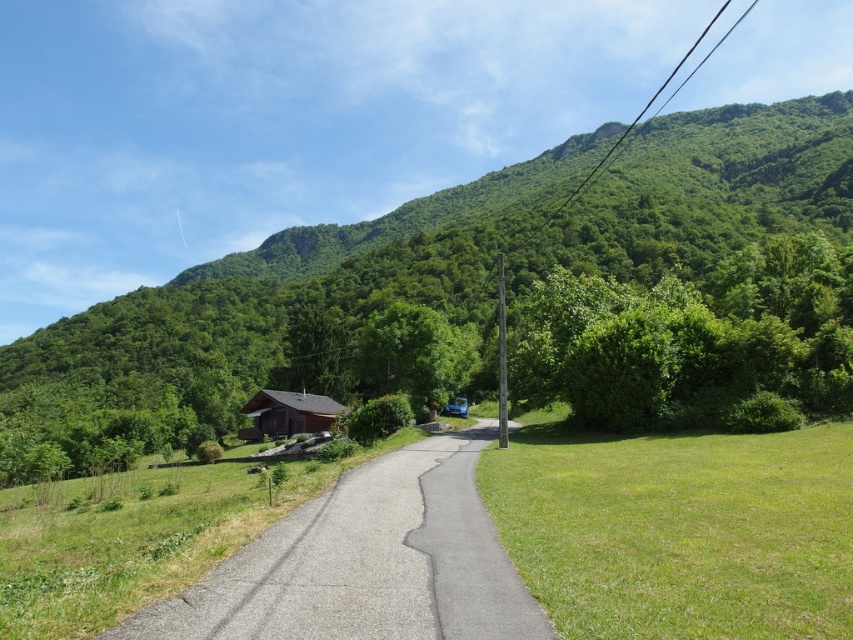
Question: Which object appears closest to the camera in this image?

Choices:
 (A) green leafy tree at center
 (B) gray asphalt driveway at center
 (C) brown wooden cabin at center

Answer: (B)

Question: Considering the relative positions of gray asphalt driveway at center and brown wooden cabin at center in the image provided, where is gray asphalt driveway at center located with respect to brown wooden cabin at center?

Choices:
 (A) above
 (B) below

Answer: (A)

Question: Is green leafy tree at center to the right of brown wooden cabin at center from the viewer's perspective?

Choices:
 (A) yes
 (B) no

Answer: (A)

Question: Which object is the closest to the brown wooden cabin at center?

Choices:
 (A) green leafy tree at center
 (B) gray asphalt driveway at center

Answer: (B)

Question: Estimate the real-world distances between objects in this image. Which object is farther from the gray asphalt driveway at center?

Choices:
 (A) brown wooden cabin at center
 (B) green leafy tree at center

Answer: (B)

Question: Considering the relative positions of green leafy tree at center and brown wooden cabin at center in the image provided, where is green leafy tree at center located with respect to brown wooden cabin at center?

Choices:
 (A) right
 (B) left

Answer: (A)